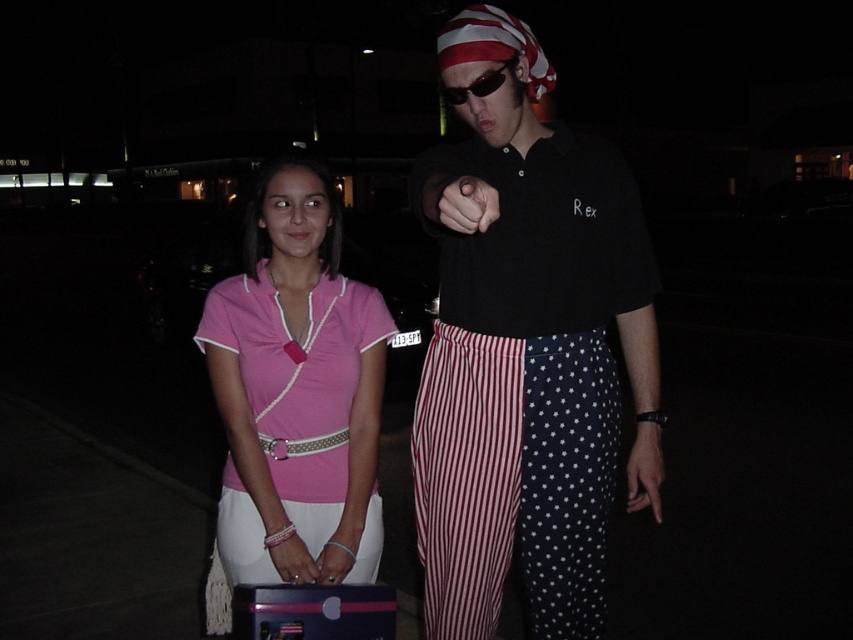
Question: Can you confirm if black cotton shirt at center is positioned to the left of sunglasses at center?

Choices:
 (A) no
 (B) yes

Answer: (A)

Question: Which point is closer to the camera taking this photo?

Choices:
 (A) (474, 80)
 (B) (258, 550)

Answer: (A)

Question: Which object is positioned farthest from the black cotton shirt at center?

Choices:
 (A) sunglasses at center
 (B) pink fabric shirt at center
 (C) black matte hand at center

Answer: (A)

Question: From the image, what is the correct spatial relationship of black cotton shirt at center in relation to sunglasses at center?

Choices:
 (A) above
 (B) below

Answer: (B)

Question: Among these points, which one is farthest from the camera?

Choices:
 (A) (460, 252)
 (B) (242, 522)

Answer: (A)

Question: Can you confirm if black cotton shirt at center is smaller than sunglasses at center?

Choices:
 (A) yes
 (B) no

Answer: (A)